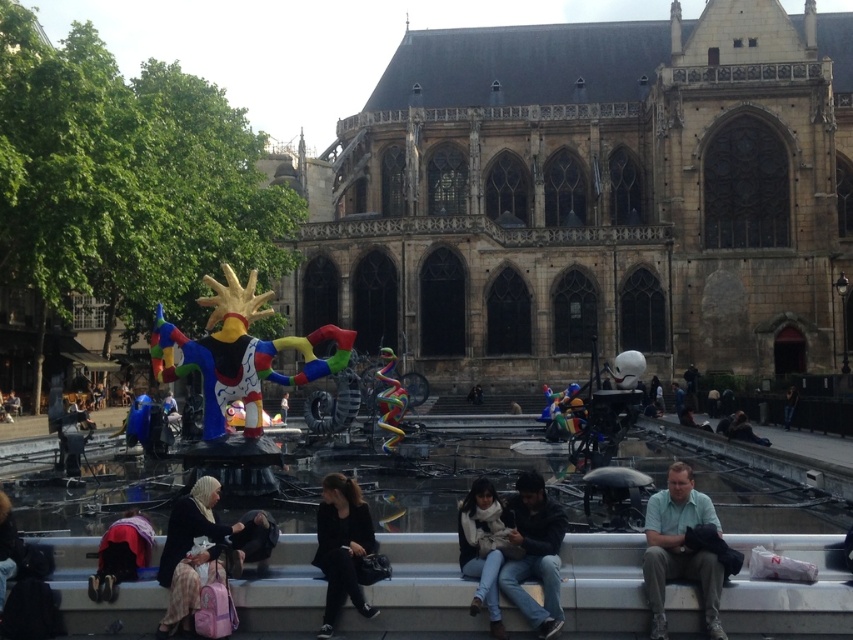
Question: From the image, what is the correct spatial relationship of plaid skirt at lower left in relation to dark blue fabric at lower left?

Choices:
 (A) right
 (B) left

Answer: (A)

Question: Among these objects, which one is farthest from the camera?

Choices:
 (A) dark blue fabric at lower left
 (B) white scarf at lower center
 (C) black matte jacket at lower center
 (D) plaid skirt at lower left

Answer: (A)

Question: Is light green shirt at lower right to the right of white scarf at lower center from the viewer's perspective?

Choices:
 (A) yes
 (B) no

Answer: (A)

Question: Which is farther from the light green shirt at lower right?

Choices:
 (A) plaid skirt at lower left
 (B) dark blue jeans at center

Answer: (A)

Question: Does light green shirt at lower right have a lesser width compared to black matte jacket at lower center?

Choices:
 (A) yes
 (B) no

Answer: (A)

Question: Among these points, which one is nearest to the camera?

Choices:
 (A) (329, 483)
 (B) (100, 596)
 (C) (173, 506)

Answer: (B)